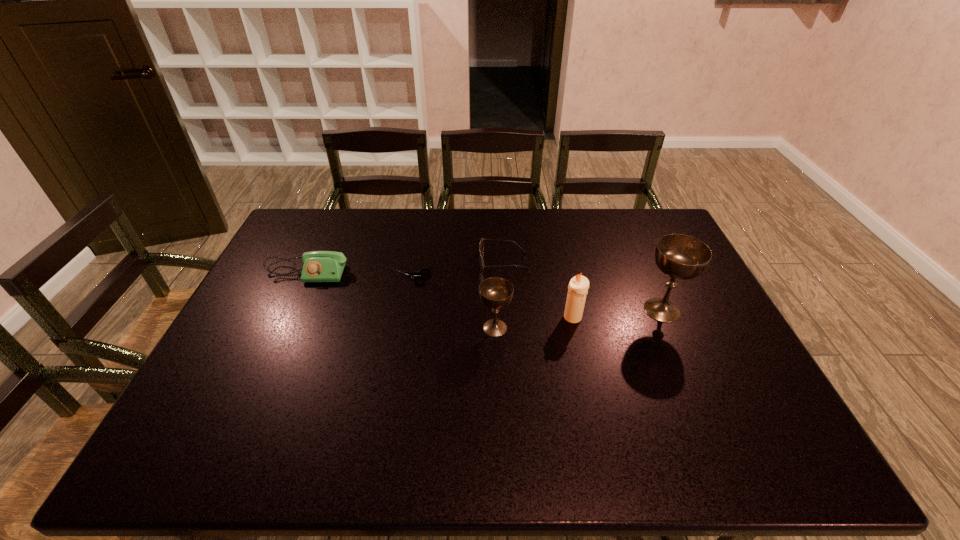
The height and width of the screenshot is (540, 960). In order to click on free region located on the left of the taller chalice in this screenshot , I will do `click(522, 310)`.

In order to click on vacant space situated 0.080m on the front-facing side of the fifth tallest object in this screenshot , I will do `click(455, 261)`.

Where is `blank space located on the front-facing side of the fifth tallest object`? blank space located on the front-facing side of the fifth tallest object is located at coordinates (395, 261).

At what (x,y) coordinates should I click in order to perform the action: click on vacant space situated 0.380m on the front-facing side of the fifth tallest object. Please return your answer as a coordinate pair (x, y). The height and width of the screenshot is (540, 960). Looking at the image, I should click on (365, 261).

I want to click on blank space located 0.350m on the front of the second object from left to right, so click(396, 380).

At what (x,y) coordinates should I click in order to perform the action: click on vacant space located 0.250m on the dial of the telephone. Please return your answer as a coordinate pair (x, y). The image size is (960, 540). Looking at the image, I should click on (273, 346).

The width and height of the screenshot is (960, 540). Find the location of `free point located on the front of the second object from right to left`. free point located on the front of the second object from right to left is located at coordinates pos(588,390).

Where is `object present at the left edge`? The image size is (960, 540). object present at the left edge is located at coordinates (319, 266).

Find the location of a particular element. The width and height of the screenshot is (960, 540). object that is at the right edge is located at coordinates (683, 257).

This screenshot has height=540, width=960. What are the coordinates of `vacant position at the far edge of the desktop` in the screenshot? It's located at (585, 240).